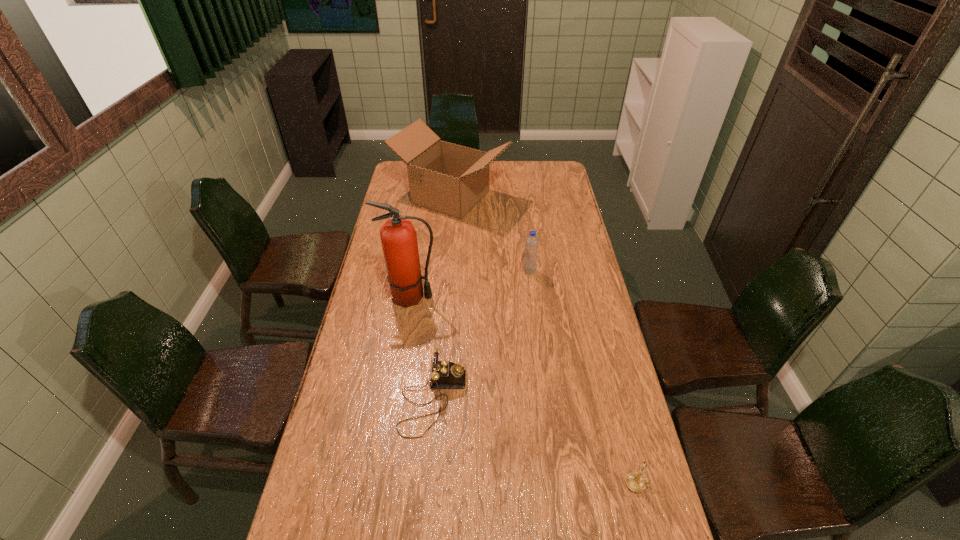
Where is `the third closest object to the farthest object`? This screenshot has width=960, height=540. the third closest object to the farthest object is located at coordinates (444, 374).

Select which object is the second closest to the nearest object. Please provide its 2D coordinates. Your answer should be formatted as a tuple, i.e. [(x, y)], where the tuple contains the x and y coordinates of a point satisfying the conditions above.

[(532, 242)]

This screenshot has width=960, height=540. In order to click on free space that satisfies the following two spatial constraints: 1. on the front side of the fourth object from left to right; 2. on the dial of the telephone in this screenshot , I will do `click(545, 400)`.

Find the location of `vacant point that satisfies the following two spatial constraints: 1. on the front side of the second tallest object; 2. on the dial of the telephone`. vacant point that satisfies the following two spatial constraints: 1. on the front side of the second tallest object; 2. on the dial of the telephone is located at coordinates (433, 400).

You are a GUI agent. You are given a task and a screenshot of the screen. Output one action in this format:
    pyautogui.click(x=<x>, y=<y>)
    Task: Click on the vacant space that satisfies the following two spatial constraints: 1. on the front side of the fourth shortest object; 2. on the nozzle of the fire extinguisher
    
    Given the screenshot: What is the action you would take?
    pyautogui.click(x=443, y=297)